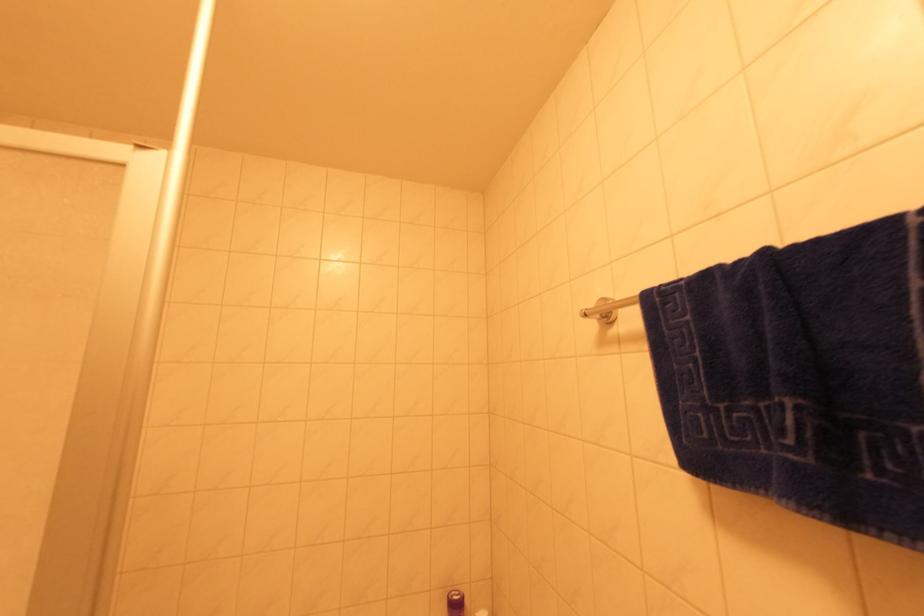
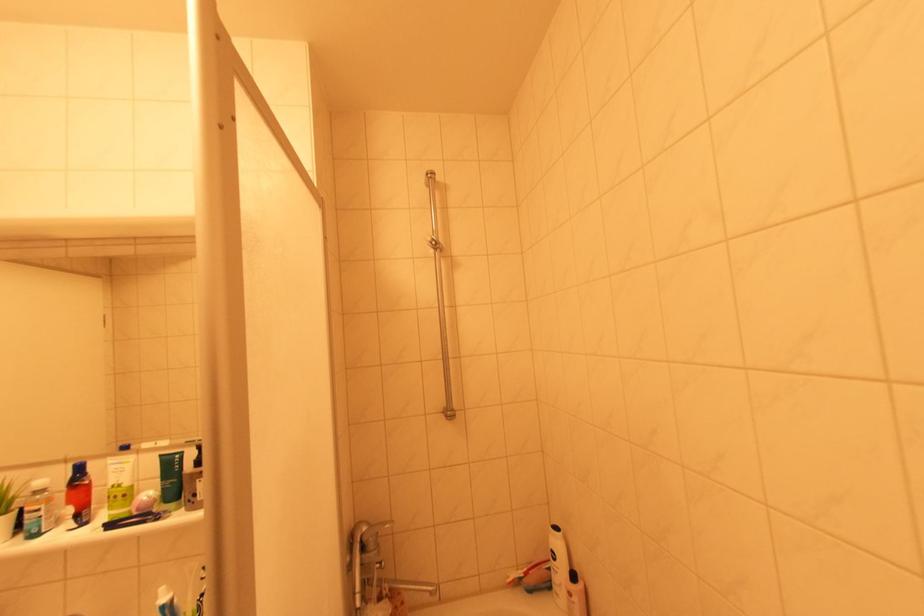
Question: The camera is either moving clockwise (left) or counter-clockwise (right) around the object. The first image is from the beginning of the video and the second image is from the end. Is the camera moving left or right when shooting the video?

Choices:
 (A) Left
 (B) Right

Answer: (B)